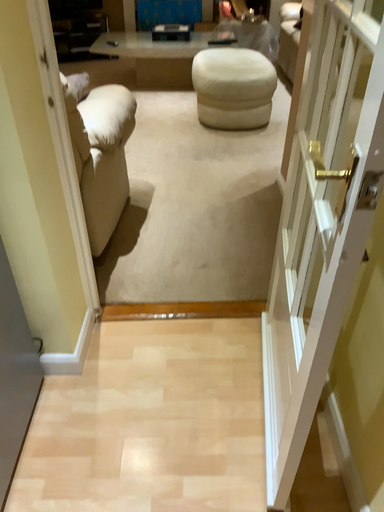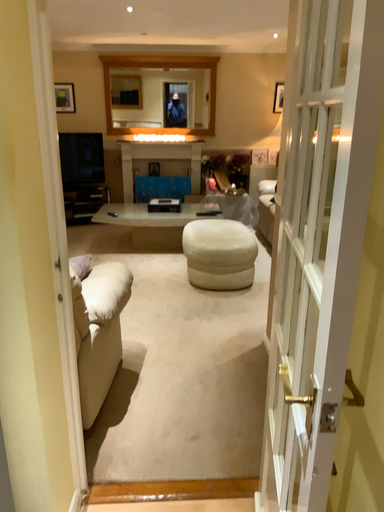
Question: How did the camera likely rotate when shooting the video?

Choices:
 (A) rotated upward
 (B) rotated downward

Answer: (A)